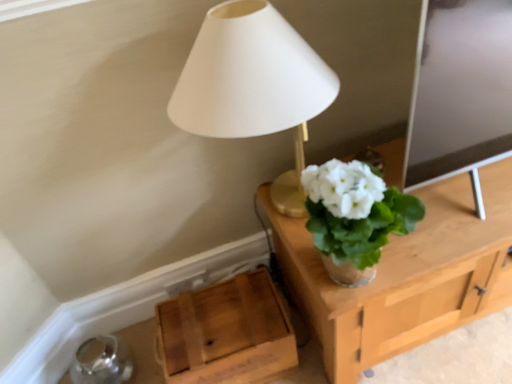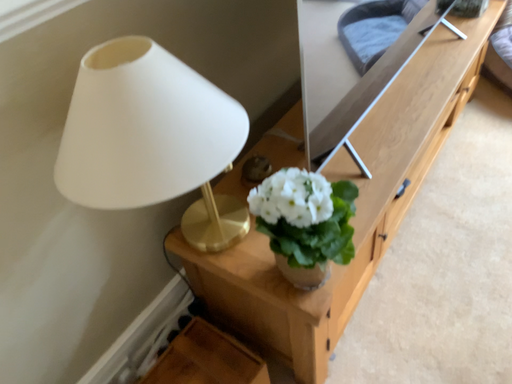
Question: Which way did the camera rotate in the video?

Choices:
 (A) rotated right
 (B) rotated left

Answer: (A)